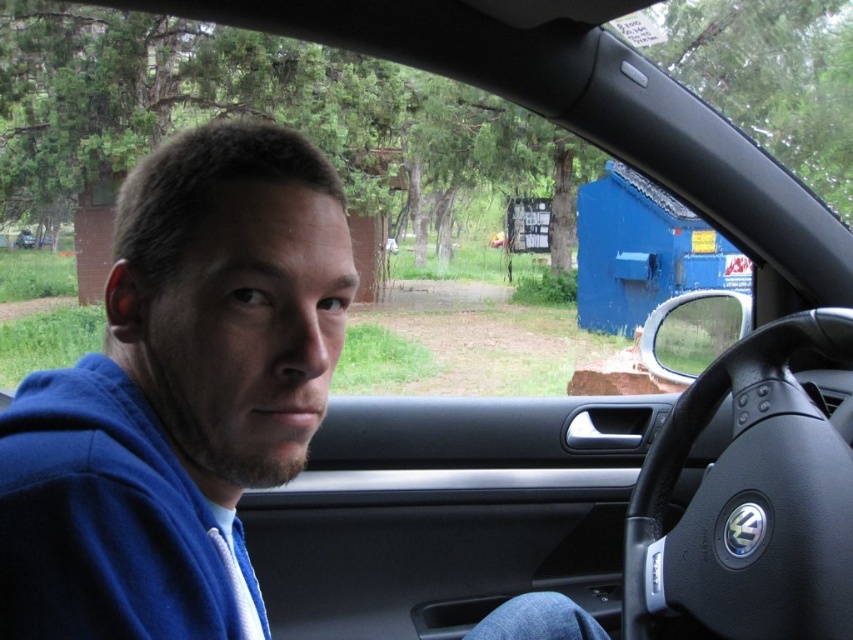
Which is more to the right, blue fleece sweatshirt at left or matte black car at center?

From the viewer's perspective, blue fleece sweatshirt at left appears more on the right side.

This screenshot has width=853, height=640. What do you see at coordinates (109, 522) in the screenshot?
I see `blue fleece sweatshirt at left` at bounding box center [109, 522].

Locate an element on the screen. The height and width of the screenshot is (640, 853). blue fleece sweatshirt at left is located at coordinates (109, 522).

You are a GUI agent. You are given a task and a screenshot of the screen. Output one action in this format:
    pyautogui.click(x=<x>, y=<y>)
    Task: Click on the blue fleece sweatshirt at left
    The height and width of the screenshot is (640, 853).
    Given the screenshot: What is the action you would take?
    pyautogui.click(x=109, y=522)

Find the location of a particular element. The width and height of the screenshot is (853, 640). blue fleece sweatshirt at left is located at coordinates (109, 522).

Is the position of blue fleece jacket at left more distant than that of blue fleece sweatshirt at left?

Yes, it is behind blue fleece sweatshirt at left.

Looking at this image, can you confirm if blue fleece jacket at left is positioned below blue fleece sweatshirt at left?

Incorrect, blue fleece jacket at left is not positioned below blue fleece sweatshirt at left.

Describe the element at coordinates (178, 396) in the screenshot. The height and width of the screenshot is (640, 853). I see `blue fleece jacket at left` at that location.

Where is `blue fleece jacket at left`? This screenshot has height=640, width=853. blue fleece jacket at left is located at coordinates (178, 396).